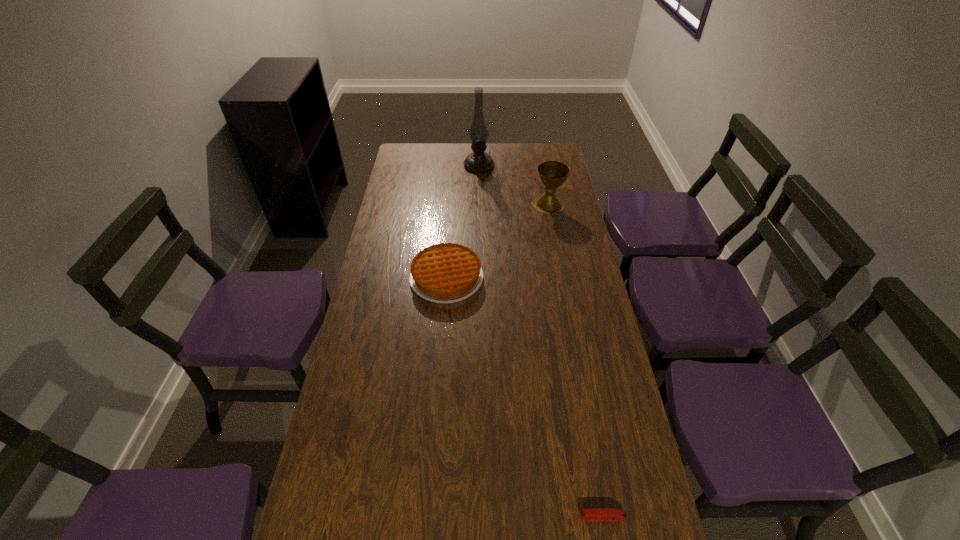
Image resolution: width=960 pixels, height=540 pixels. I want to click on free space at the right edge of the desktop, so click(x=559, y=286).

This screenshot has height=540, width=960. Identify the location of vacant area that lies between the third nearest object and the nearest object. (575, 361).

Find the location of a particular element. Image resolution: width=960 pixels, height=540 pixels. free space between the second shortest object and the chalice is located at coordinates (497, 241).

Where is `free point between the third shortest object and the third farthest object`? This screenshot has width=960, height=540. free point between the third shortest object and the third farthest object is located at coordinates (497, 241).

At what (x,y) coordinates should I click in order to perform the action: click on free space between the third shortest object and the second shortest object. Please return your answer as a coordinate pair (x, y). The width and height of the screenshot is (960, 540). Looking at the image, I should click on (497, 241).

Identify the location of free spot between the chalice and the nearest object. (575, 361).

The height and width of the screenshot is (540, 960). Identify the location of vacant space that is in between the pie and the tallest object. (463, 222).

Image resolution: width=960 pixels, height=540 pixels. I want to click on vacant area that lies between the pie and the farthest object, so click(463, 222).

This screenshot has width=960, height=540. In order to click on vacant space that's between the chalice and the oil lamp in this screenshot , I will do `click(514, 185)`.

Identify the location of vacant space that is in between the second tallest object and the stapler. (575, 361).